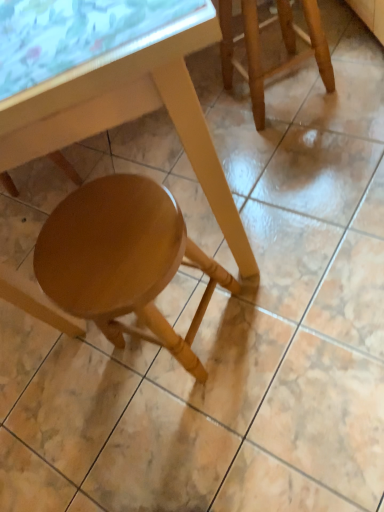
Question: Considering the relative sizes of matte wood table at lower center and glossy wood stool at lower center, which is the second stool in top-to-bottom order, in the image provided, is matte wood table at lower center taller than glossy wood stool at lower center, which is the second stool in top-to-bottom order,?

Choices:
 (A) no
 (B) yes

Answer: (B)

Question: Is matte wood table at lower center outside of glossy wood stool at lower center, which is counted as the 2th stool, starting from the right?

Choices:
 (A) no
 (B) yes

Answer: (B)

Question: Does matte wood table at lower center come behind glossy wood stool at lower center, marked as the first stool in a bottom-to-top arrangement?

Choices:
 (A) yes
 (B) no

Answer: (B)

Question: Does matte wood table at lower center have a greater width compared to glossy wood stool at lower center, which is counted as the 2th stool, starting from the right?

Choices:
 (A) no
 (B) yes

Answer: (B)

Question: Is matte wood table at lower center positioned in front of glossy wood stool at lower center, which is the second stool in top-to-bottom order?

Choices:
 (A) no
 (B) yes

Answer: (B)

Question: Considering the positions of point (241, 1) and point (48, 49), is point (241, 1) closer or farther from the camera than point (48, 49)?

Choices:
 (A) farther
 (B) closer

Answer: (A)

Question: From the image's perspective, is wooden stool at upper right, the 1th stool positioned from the top, positioned above or below transparent glass table at upper left?

Choices:
 (A) above
 (B) below

Answer: (A)

Question: In terms of height, does wooden stool at upper right, which is the second stool in bottom-to-top order, look taller or shorter compared to transparent glass table at upper left?

Choices:
 (A) tall
 (B) short

Answer: (A)

Question: Is wooden stool at upper right, which is the second stool in bottom-to-top order, wider or thinner than transparent glass table at upper left?

Choices:
 (A) thin
 (B) wide

Answer: (A)

Question: Considering the positions of matte wood table at lower center and wooden stool at upper right, the 1th stool positioned from the top, in the image, is matte wood table at lower center wider or thinner than wooden stool at upper right, the 1th stool positioned from the top,?

Choices:
 (A) wide
 (B) thin

Answer: (A)

Question: From a real-world perspective, relative to wooden stool at upper right, the 1th stool viewed from the right, is matte wood table at lower center vertically above or below?

Choices:
 (A) above
 (B) below

Answer: (A)

Question: Considering the positions of point (162, 95) and point (307, 24), is point (162, 95) closer or farther from the camera than point (307, 24)?

Choices:
 (A) closer
 (B) farther

Answer: (A)

Question: In terms of height, does matte wood table at lower center look taller or shorter compared to wooden stool at upper right, arranged as the 2th stool when viewed from the left?

Choices:
 (A) short
 (B) tall

Answer: (B)

Question: In terms of width, does wooden stool at upper right, the 1th stool positioned from the top, look wider or thinner when compared to glossy wood stool at lower center, marked as the first stool in a bottom-to-top arrangement?

Choices:
 (A) thin
 (B) wide

Answer: (A)

Question: From the image's perspective, is wooden stool at upper right, which is the second stool in bottom-to-top order, above or below glossy wood stool at lower center, marked as the first stool in a bottom-to-top arrangement?

Choices:
 (A) above
 (B) below

Answer: (A)